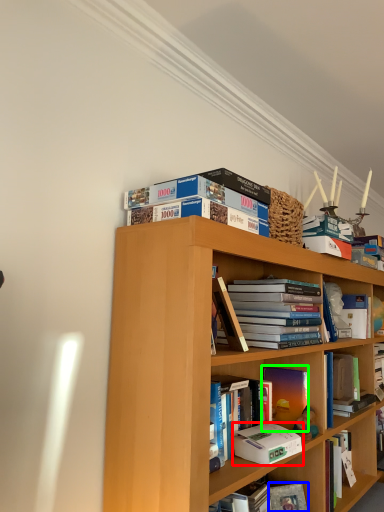
Question: Based on their relative distances, which object is farther from paperback book (highlighted by a red box)? Choose from paperback book (highlighted by a blue box) and book (highlighted by a green box).

Choices:
 (A) paperback book
 (B) book

Answer: (A)